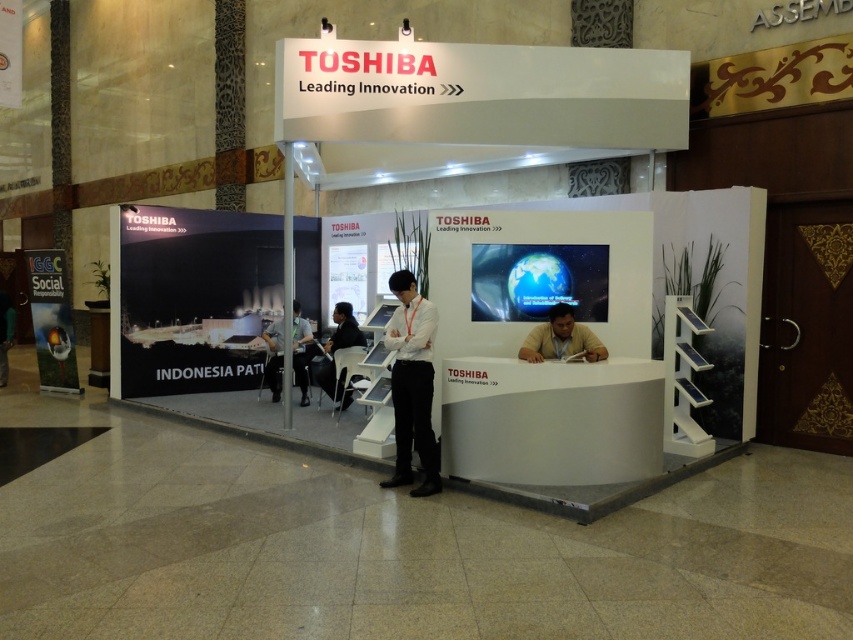
Does point (410, 333) come closer to viewer compared to point (556, 308)?

That is True.

Is white shirt at center in front of brown leather jacket at center?

Yes, white shirt at center is in front of brown leather jacket at center.

Which is behind, point (393, 340) or point (579, 324)?

The point (579, 324) is behind.

Identify the location of white shirt at center. Image resolution: width=853 pixels, height=640 pixels. (412, 385).

Is white fabric shirt at center taller than black fabric chair at center?

Indeed, white fabric shirt at center has a greater height compared to black fabric chair at center.

Image resolution: width=853 pixels, height=640 pixels. In order to click on white fabric shirt at center in this screenshot , I will do `click(300, 349)`.

Which is above, white shirt at center or white fabric shirt at center?

Positioned higher is white fabric shirt at center.

Is white shirt at center positioned in front of white fabric shirt at center?

That is True.

Locate an element on the screen. Image resolution: width=853 pixels, height=640 pixels. white shirt at center is located at coordinates (412, 385).